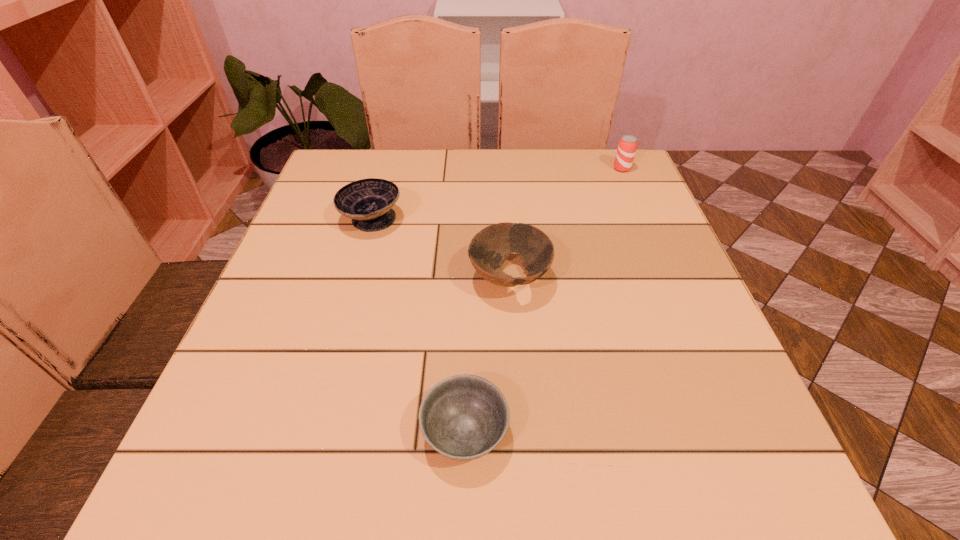
This screenshot has height=540, width=960. Find the location of `vacant area at the far left corner of the desktop`. vacant area at the far left corner of the desktop is located at coordinates (368, 170).

Where is `vacant space at the far right corner`? The image size is (960, 540). vacant space at the far right corner is located at coordinates (611, 165).

In the image, there is a desktop. Where is `vacant area at the near right corner`? The width and height of the screenshot is (960, 540). vacant area at the near right corner is located at coordinates (660, 451).

Image resolution: width=960 pixels, height=540 pixels. I want to click on free space between the farthest bowl and the second farthest bowl, so click(441, 249).

Identify the location of vacant space that's between the beer can and the leftmost bowl. The width and height of the screenshot is (960, 540). (496, 194).

In order to click on free spot between the shortest bowl and the second nearest bowl in this screenshot , I will do point(488,356).

This screenshot has height=540, width=960. I want to click on free space between the shortest object and the second farthest object, so click(x=419, y=326).

At what (x,y) coordinates should I click in order to perform the action: click on vacant area that lies between the second farthest object and the nearest object. Please return your answer as a coordinate pair (x, y). Looking at the image, I should click on (419, 326).

Where is `free space between the shortest object and the second nearest object`? The width and height of the screenshot is (960, 540). free space between the shortest object and the second nearest object is located at coordinates (488, 356).

Locate an element on the screen. The height and width of the screenshot is (540, 960). free space between the leftmost object and the shortest bowl is located at coordinates (419, 326).